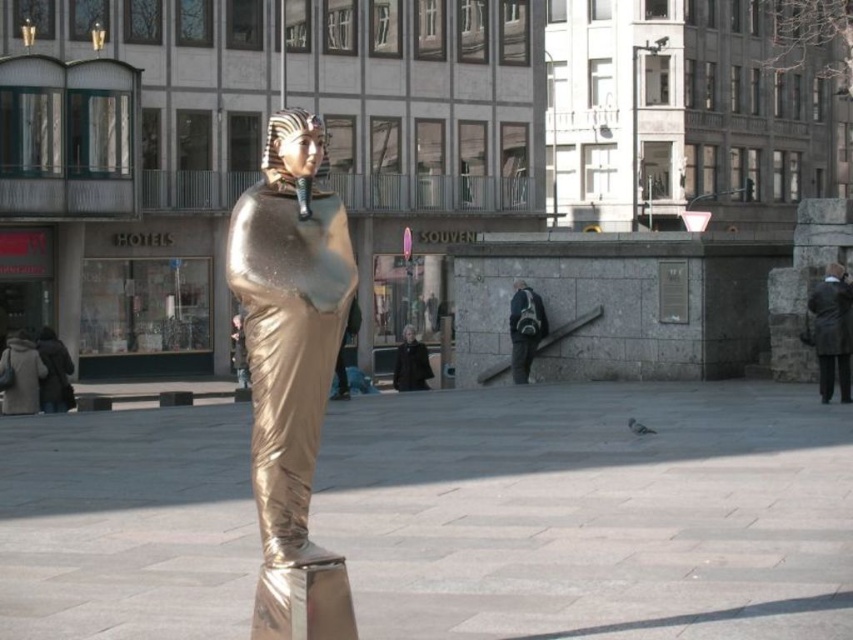
Is gold metallic statue at center closer to the viewer compared to brown leather coat at lower right?

That is True.

From the picture: Who is more distant from viewer, (276, 518) or (822, 397)?

The point (822, 397) is behind.

At what (x,y) coordinates should I click in order to perform the action: click on gold metallic statue at center. Please return your answer as a coordinate pair (x, y). The image size is (853, 640). Looking at the image, I should click on (291, 369).

Does gold metallic statue at center have a lesser height compared to dark gray backpack at center?

No, gold metallic statue at center is not shorter than dark gray backpack at center.

Which of these two, gold metallic statue at center or dark gray backpack at center, stands shorter?

dark gray backpack at center

Where is `gold metallic statue at center`? Image resolution: width=853 pixels, height=640 pixels. gold metallic statue at center is located at coordinates (291, 369).

Is brown leather coat at lower right wider than dark gray backpack at center?

Yes, brown leather coat at lower right is wider than dark gray backpack at center.

Where is `brown leather coat at lower right`? The image size is (853, 640). brown leather coat at lower right is located at coordinates (833, 330).

Find the location of a particular element. brown leather coat at lower right is located at coordinates (833, 330).